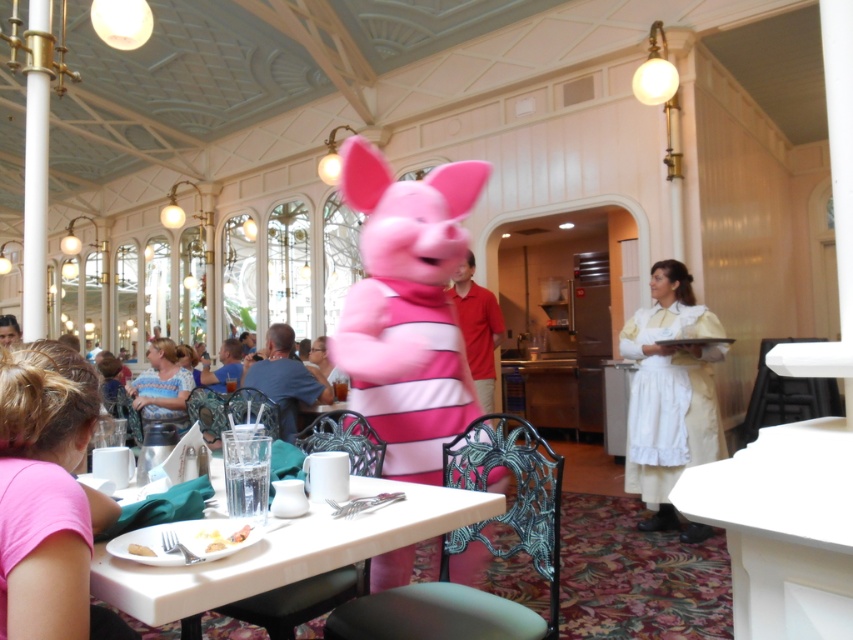
Question: Can you confirm if blue striped shirt at lower left is smaller than yellow matte bread at table center?

Choices:
 (A) yes
 (B) no

Answer: (B)

Question: Which point is farther from the camera taking this photo?

Choices:
 (A) (144, 554)
 (B) (47, 355)
 (C) (202, 534)

Answer: (B)

Question: Which point is closer to the camera taking this photo?

Choices:
 (A) (456, 515)
 (B) (634, 390)

Answer: (A)

Question: Is yellow matte bread at table center positioned behind white matte plate at lower left?

Choices:
 (A) yes
 (B) no

Answer: (A)

Question: Can you confirm if white plastic table at lower center is bigger than white cotton dress at right?

Choices:
 (A) no
 (B) yes

Answer: (A)

Question: Which object is positioned farthest from the pink fabric shirt at lower left?

Choices:
 (A) white plastic table at lower center
 (B) yellow matte bread at table center

Answer: (B)